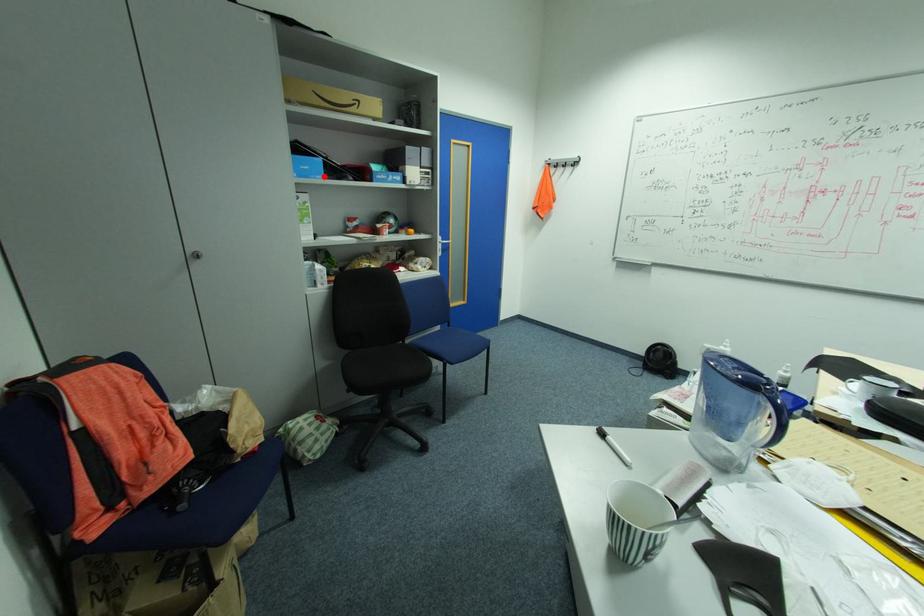
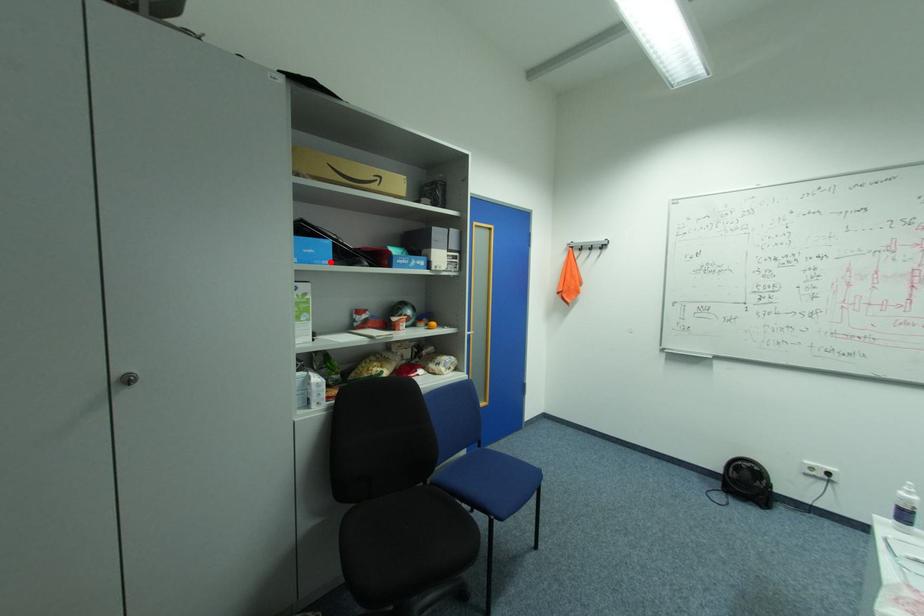
I am providing you with two images of the same scene from different viewpoints. A red point is marked on the first image and another point is marked on the second image. Is the red point in image1 aligned with the point shown in image2?

Yes